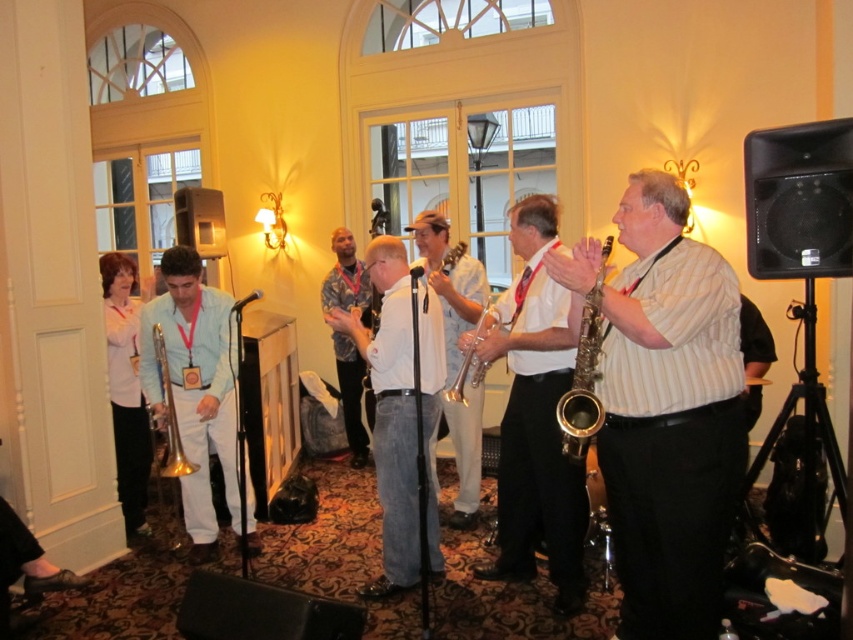
Does white cotton shirt at center have a lesser height compared to white striped shirt at center?

Indeed, white cotton shirt at center has a lesser height compared to white striped shirt at center.

Is point (434, 342) farther from camera compared to point (352, 385)?

No, it is not.

The width and height of the screenshot is (853, 640). I want to click on white cotton shirt at center, so click(390, 410).

Which is behind, point (193, 314) or point (341, 289)?

Point (341, 289)

Is matte gold trumpet at left positioned behind white striped shirt at center?

That is False.

Between point (138, 336) and point (352, 369), which one is positioned in front?

Point (138, 336) is in front.

Locate an element on the screen. This screenshot has height=640, width=853. matte gold trumpet at left is located at coordinates (196, 392).

Is white cotton shirt at center below white matte shirt at left?

Correct, white cotton shirt at center is located below white matte shirt at left.

Can you confirm if white cotton shirt at center is positioned to the right of white matte shirt at left?

Yes, white cotton shirt at center is to the right of white matte shirt at left.

Between point (432, 346) and point (115, 397), which one is positioned in front?

Positioned in front is point (432, 346).

Locate an element on the screen. Image resolution: width=853 pixels, height=640 pixels. white cotton shirt at center is located at coordinates (390, 410).